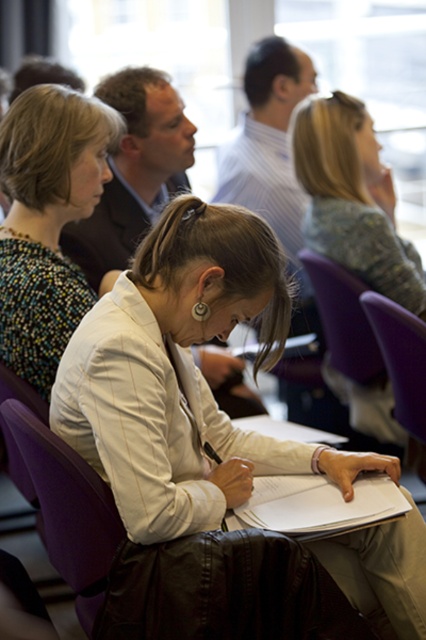
In the scene shown: You are an attendee at this event and want to sit in the purple plastic chair at lower center. Can you see the multicolored beaded necklace at upper left from your seat?

The multicolored beaded necklace at upper left is in front of the purple plastic chair at lower center, so when sitting in the purple plastic chair at lower center, you would have a clear view of the necklace as it is positioned ahead of you.

You are an attendee in the conference room and need to locate the white paper clipboard at center. Based on the coordinate system where the bottom left corner is the origin, can you tell me if the clipboard is closer to the top or bottom of the room?

The white paper clipboard at center is located at coordinate point (x=317, y=506). Since the y coordinate 0.746 is closer to 1.0 than to 0.0, the clipboard is closer to the bottom of the room.

You are an attendee in the conference room and want to locate the multicolored beaded necklace at upper left. Where exactly is it positioned in the room?

The multicolored beaded necklace at upper left is positioned at coordinates point (46, 221) in the room.